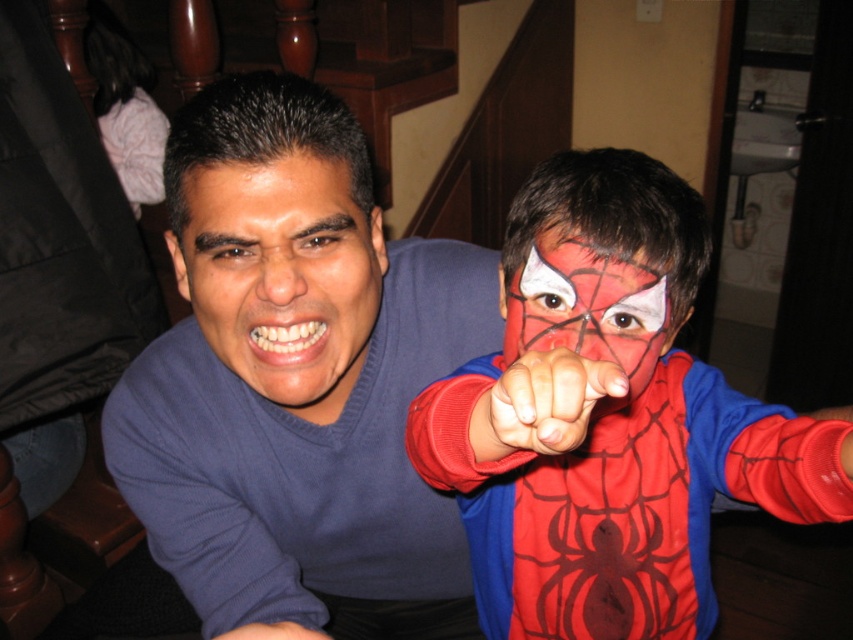
Question: Which of these objects is positioned closest to the matte blue shirt at center?

Choices:
 (A) blue cotton shirt at center
 (B) matte red face paint at center

Answer: (A)

Question: Which object is the farthest from the matte red face paint at center?

Choices:
 (A) matte red costume at center
 (B) blue cotton shirt at center

Answer: (B)

Question: Which point is closer to the camera taking this photo?

Choices:
 (A) (256, 337)
 (B) (544, 541)
 (C) (596, 276)
 (D) (378, 461)

Answer: (C)

Question: Can you confirm if matte blue shirt at center is thinner than matte red face paint at center?

Choices:
 (A) yes
 (B) no

Answer: (B)

Question: Is blue cotton shirt at center wider than matte red costume at center?

Choices:
 (A) no
 (B) yes

Answer: (B)

Question: Can you confirm if blue cotton shirt at center is wider than matte red face paint at center?

Choices:
 (A) no
 (B) yes

Answer: (B)